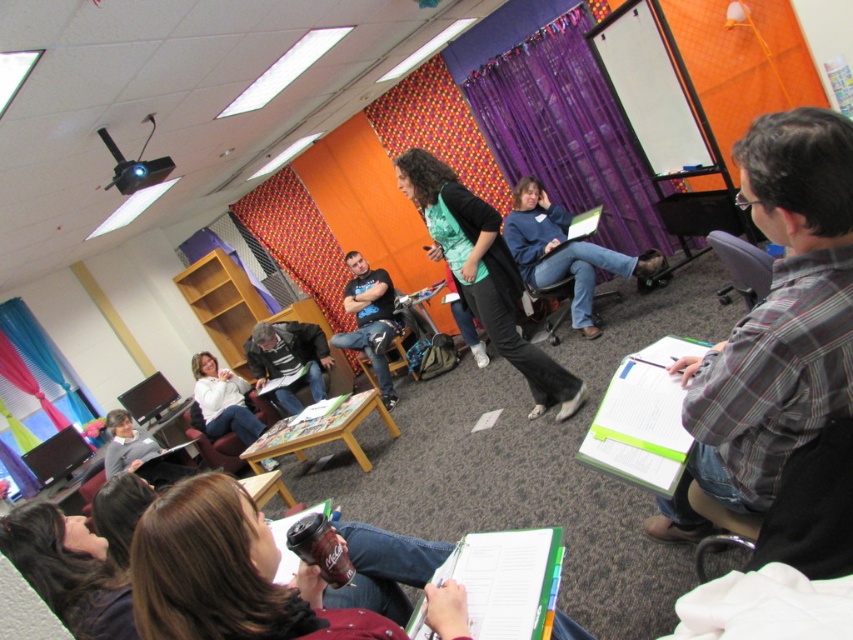
Between dark blue t-shirt at center and gray fabric chair at right, which one is positioned lower?

dark blue t-shirt at center is lower down.

Does point (352, 292) come behind point (735, 241)?

Yes, point (352, 292) is farther from viewer.

Locate an element on the screen. The width and height of the screenshot is (853, 640). dark blue t-shirt at center is located at coordinates click(x=370, y=320).

Who is more forward, (358, 259) or (560, 289)?

Point (560, 289) is in front.

Looking at this image, which is more to the right, dark blue t-shirt at center or brown leather chair at center?

brown leather chair at center

Locate an element on the screen. The width and height of the screenshot is (853, 640). dark blue t-shirt at center is located at coordinates (370, 320).

Does teal fabric shirt at center appear over dark blue t-shirt at center?

Correct, teal fabric shirt at center is located above dark blue t-shirt at center.

Who is more distant from viewer, (x=436, y=188) or (x=381, y=356)?

Point (x=381, y=356)

The width and height of the screenshot is (853, 640). Identify the location of teal fabric shirt at center. (483, 273).